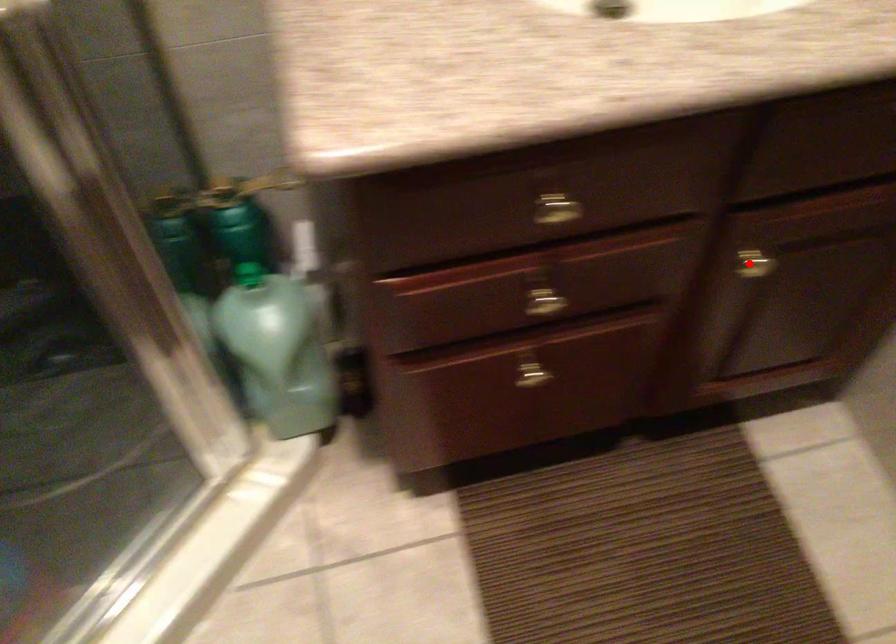
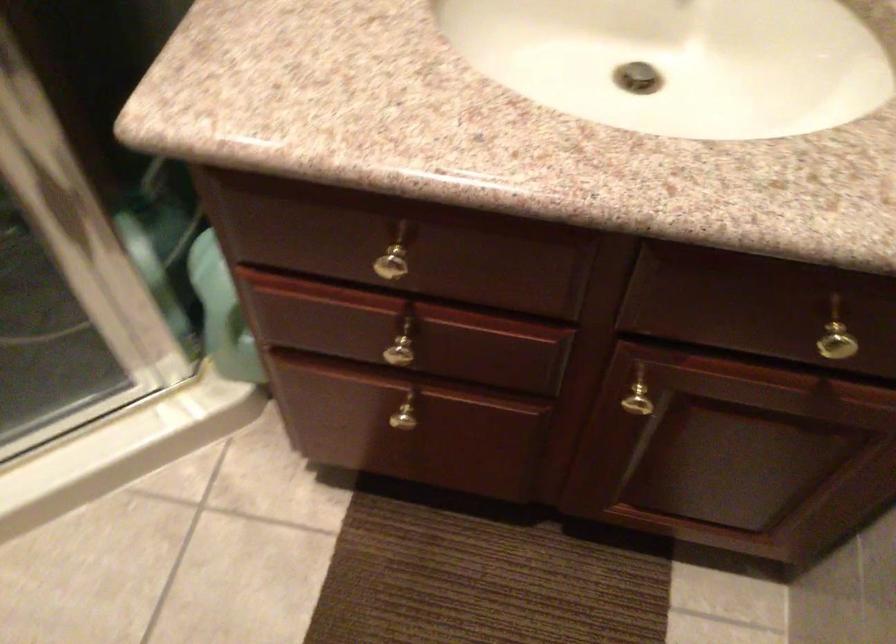
The point at the highlighted location is marked in the first image. Where is the corresponding point in the second image?

(640, 399)